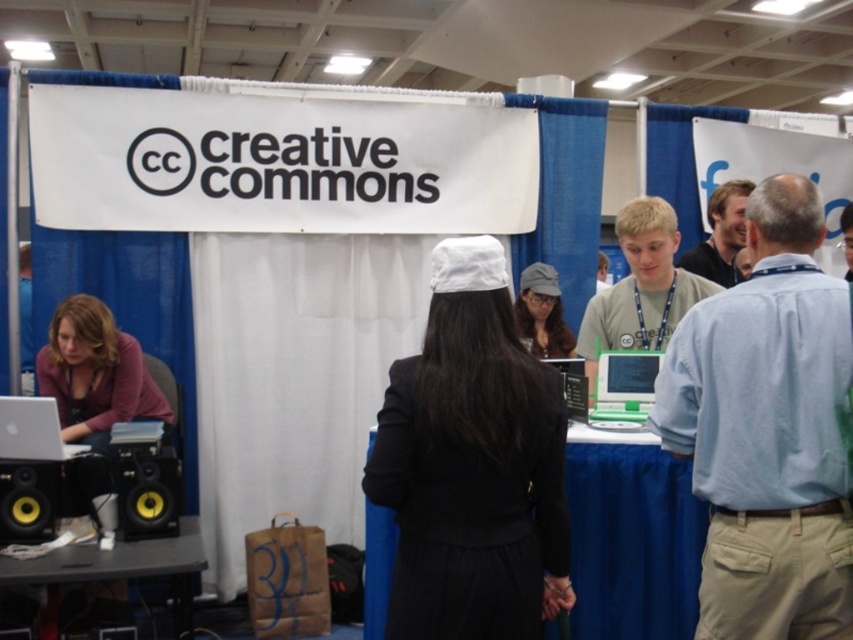
You are at the Creative Commons booth and want to know if the person wearing the matte purple sweater at left is taller than the person with light brown hair at upper right. Can you determine this based on their positions in the image?

The matte purple sweater at left is much taller as light brown hair at upper right, so yes, the person wearing the matte purple sweater at left is taller than the person with light brown hair at upper right.

You are at the Creative Commons booth and want to place a decorative item on top of the silver metallic laptop at left. Can you put the yellow glossy speaker at lower left there?

The yellow glossy speaker at lower left is located below the silver metallic laptop at left, so it cannot be placed on top of it since it is positioned underneath.

In the scene shown: What object is located at the coordinates point (631, 541) in the scene?

The point (631, 541) corresponds to the blue fabric table at center.